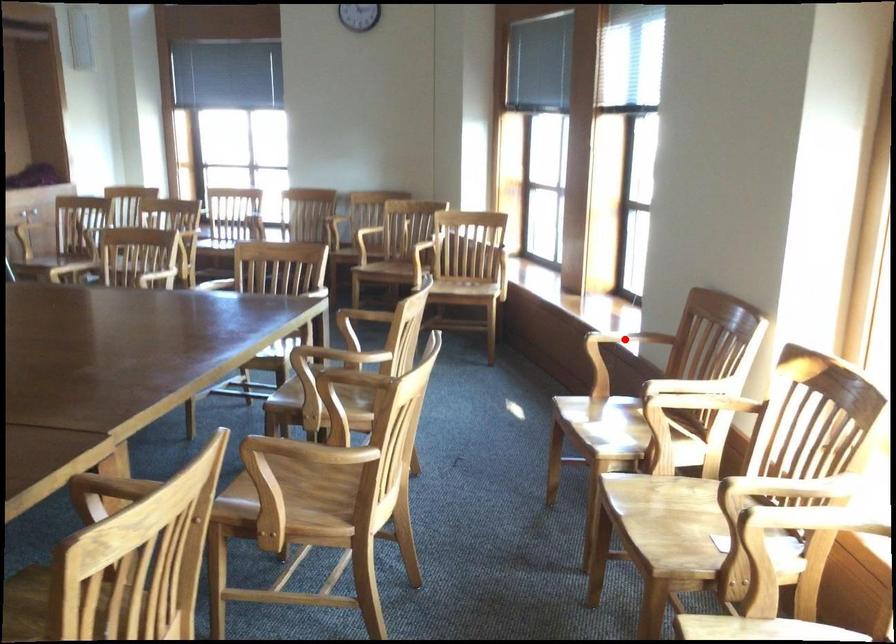
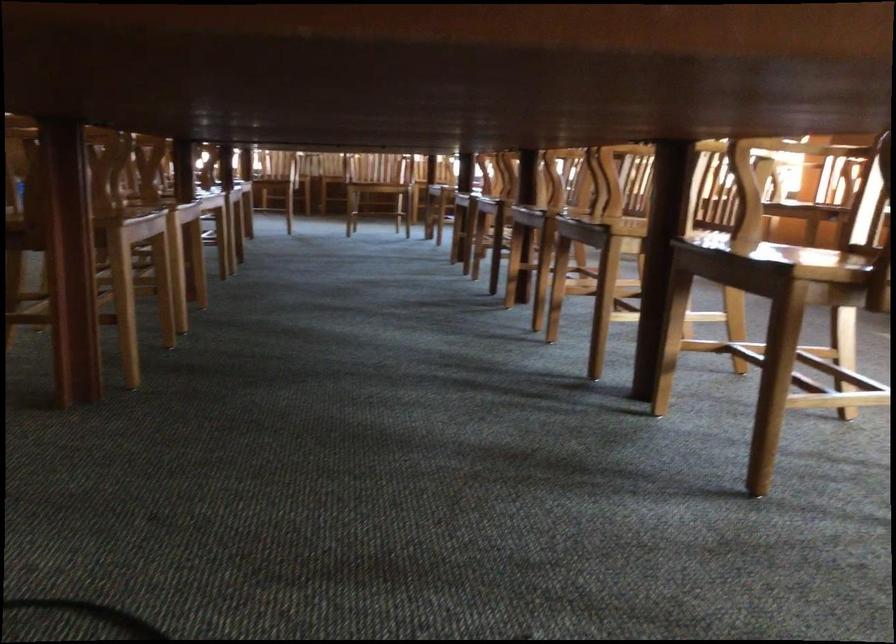
Question: I am providing you with two images of the same scene from different viewpoints. A red point is marked on the first image. Can you still see the location of the red point in image 2?

Choices:
 (A) Yes
 (B) No

Answer: (B)